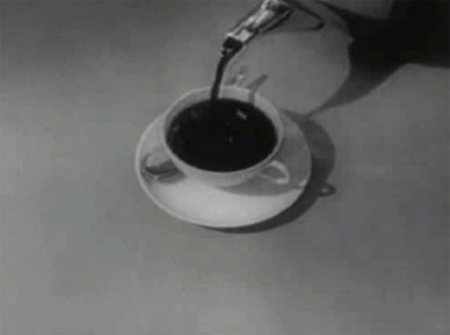
Find the location of a particular element. This screenshot has height=335, width=450. spoon handle is located at coordinates (232, 73).